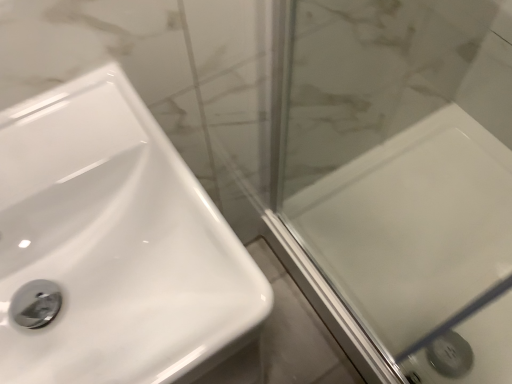
Where is `white glossy sink at left`? This screenshot has height=384, width=512. white glossy sink at left is located at coordinates (114, 246).

This screenshot has width=512, height=384. Describe the element at coordinates (114, 246) in the screenshot. I see `white glossy sink at left` at that location.

What is the approximate height of white glossy sink at left?

The height of white glossy sink at left is 16.93 centimeters.

The image size is (512, 384). I want to click on white glossy sink at left, so click(x=114, y=246).